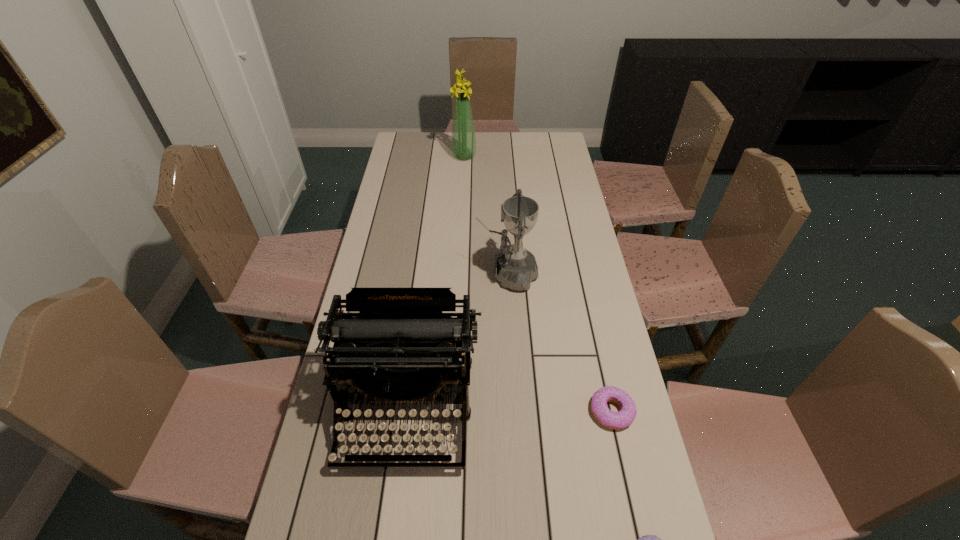
This screenshot has width=960, height=540. I want to click on the farthest object, so click(x=463, y=141).

What are the coordinates of `bouquet` in the screenshot? It's located at (463, 141).

Locate an element on the screen. This screenshot has height=540, width=960. the fourth nearest object is located at coordinates (515, 267).

Where is `typewriter`? This screenshot has height=540, width=960. typewriter is located at coordinates (400, 348).

Identify the location of the fourth tallest object. (614, 420).

The height and width of the screenshot is (540, 960). What are the coordinates of `the taller doughnut` in the screenshot? It's located at (614, 420).

At what (x,y) coordinates should I click in order to perform the action: click on free space located 0.150m on the front-facing side of the tallest object. Please return your answer as a coordinate pair (x, y). The image size is (960, 540). Looking at the image, I should click on (509, 156).

Where is `vacant area situated on the side with emblem of the second farthest object`? This screenshot has width=960, height=540. vacant area situated on the side with emblem of the second farthest object is located at coordinates (458, 274).

You are a GUI agent. You are given a task and a screenshot of the screen. Output one action in this format:
    pyautogui.click(x=<x>, y=<y>)
    Task: Click on the free space located on the side with emblem of the second farthest object
    The image size is (960, 540).
    Given the screenshot: What is the action you would take?
    pyautogui.click(x=402, y=274)

The image size is (960, 540). I want to click on vacant region located on the side with emblem of the second farthest object, so click(438, 274).